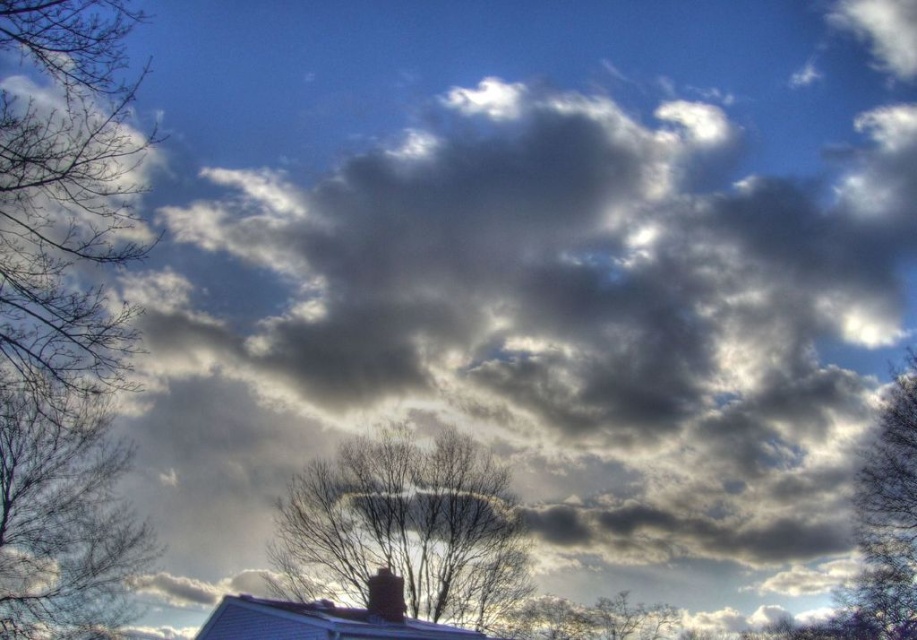
Question: Among these objects, which one is nearest to the camera?

Choices:
 (A) smooth bark tree at right
 (B) smooth gray chimney at center

Answer: (B)

Question: Considering the relative positions of bare branches at left and smooth gray chimney at center in the image provided, where is bare branches at left located with respect to smooth gray chimney at center?

Choices:
 (A) below
 (B) above

Answer: (B)

Question: Is bare branches at left wider than smooth bark tree at right?

Choices:
 (A) yes
 (B) no

Answer: (A)

Question: Which point is farther to the camera?

Choices:
 (A) (396, 600)
 (B) (838, 636)

Answer: (B)

Question: From the image, what is the correct spatial relationship of bare branches at center in relation to smooth bark tree at right?

Choices:
 (A) right
 (B) left

Answer: (B)

Question: Which is farther from the smooth bark tree at right?

Choices:
 (A) bare branches at center
 (B) bare branches at left

Answer: (B)